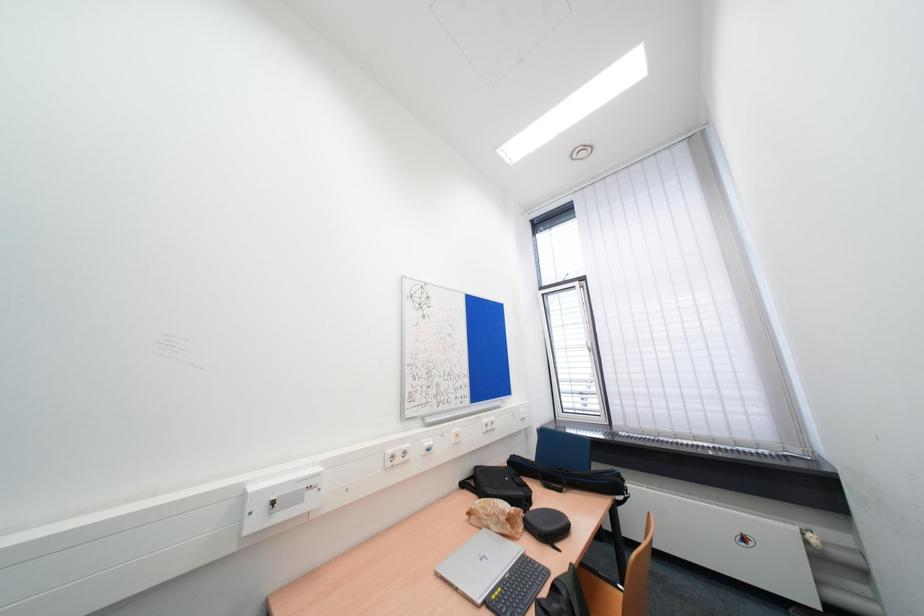
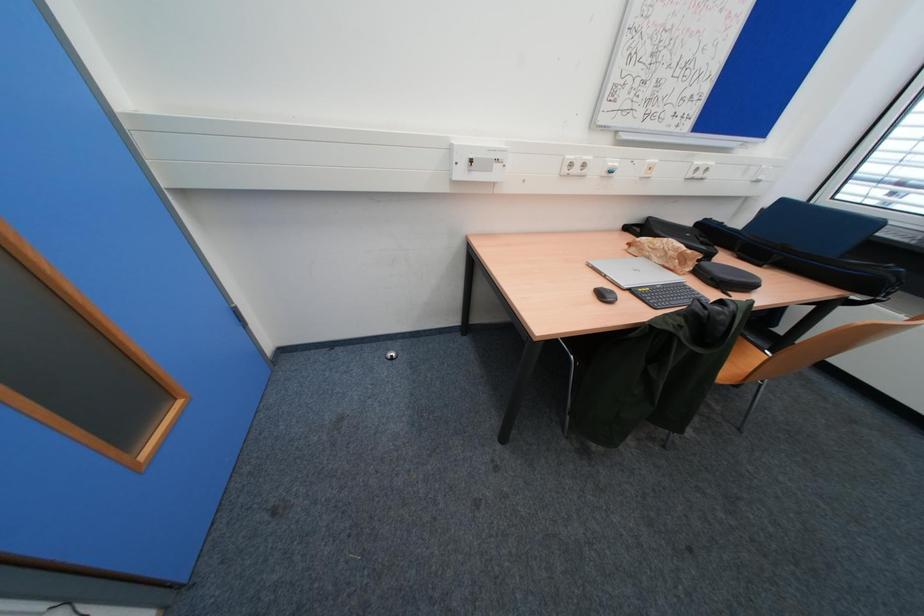
The images are taken continuously from a first-person perspective. In which direction is your viewpoint rotating?

The camera's rotation is toward left-down.